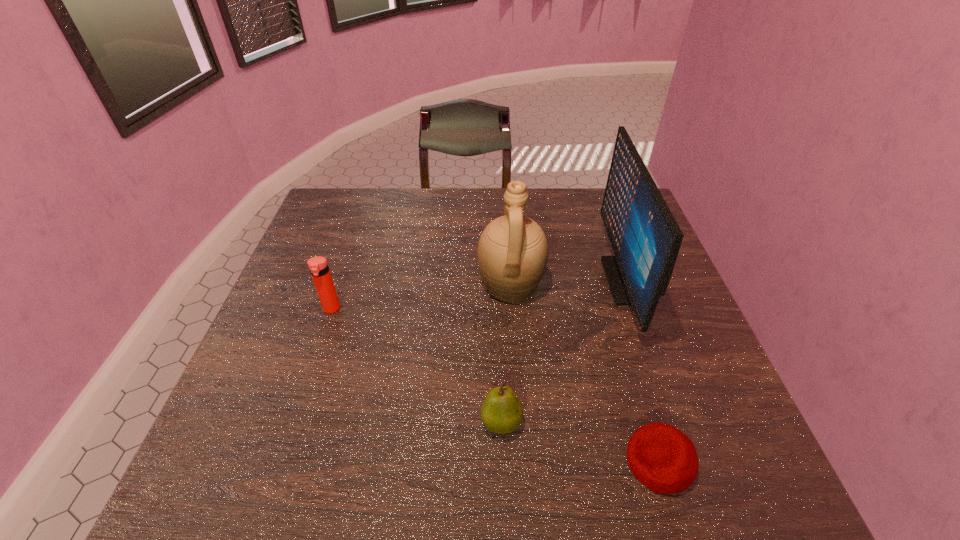
Where is `object located at the far right corner`? This screenshot has width=960, height=540. object located at the far right corner is located at coordinates (645, 237).

Identify the location of object that is at the near right corner. (664, 459).

Identify the location of vacant space at the far edge of the desktop. (502, 214).

I want to click on blank space at the near edge, so click(x=516, y=460).

Image resolution: width=960 pixels, height=540 pixels. Find the location of `free space at the left edge of the desktop`. free space at the left edge of the desktop is located at coordinates (244, 394).

The image size is (960, 540). Find the location of `vacant space at the right edge`. vacant space at the right edge is located at coordinates (654, 345).

At what (x,y) coordinates should I click in order to perform the action: click on vacant space at the far left corner. Please return your answer as a coordinate pair (x, y). Looking at the image, I should click on (327, 194).

Where is `free space at the near left corner of the desktop`? free space at the near left corner of the desktop is located at coordinates (236, 466).

Find the location of `vacant area at the near right corner of the desktop`. vacant area at the near right corner of the desktop is located at coordinates (730, 469).

Identify the location of vacant space that is in between the leftmost object and the computer monitor. [478, 294].